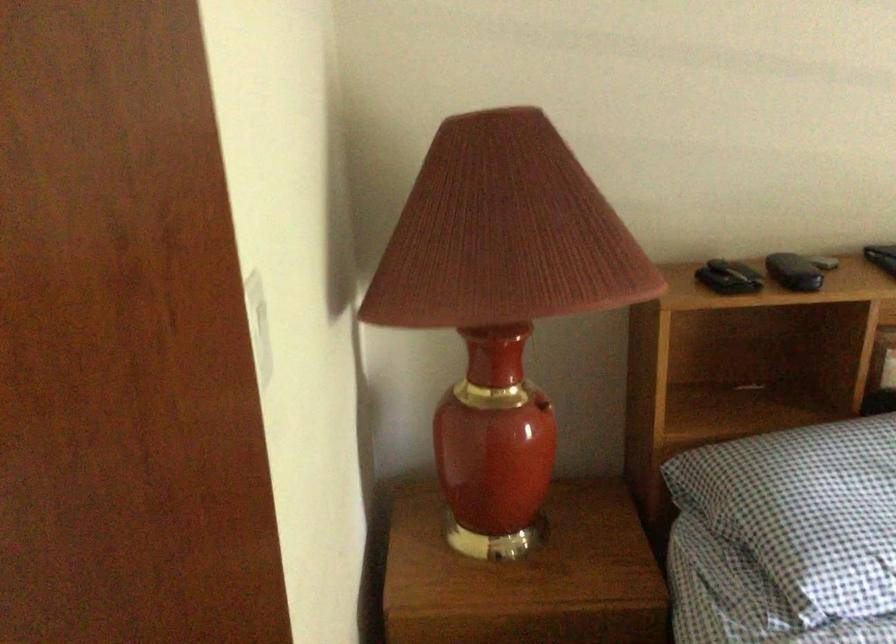
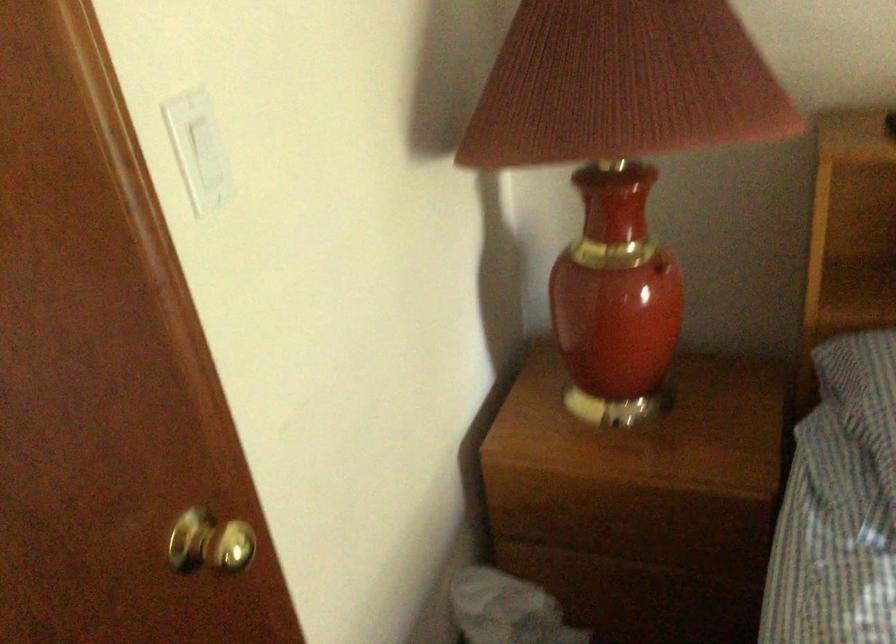
Question: I am providing you with two images of the same scene from different viewpoints. Which of the following objects are not visible in image2?

Choices:
 (A) gold door knob
 (B) white light switch
 (C) red lamp switch
 (D) none of these

Answer: (D)